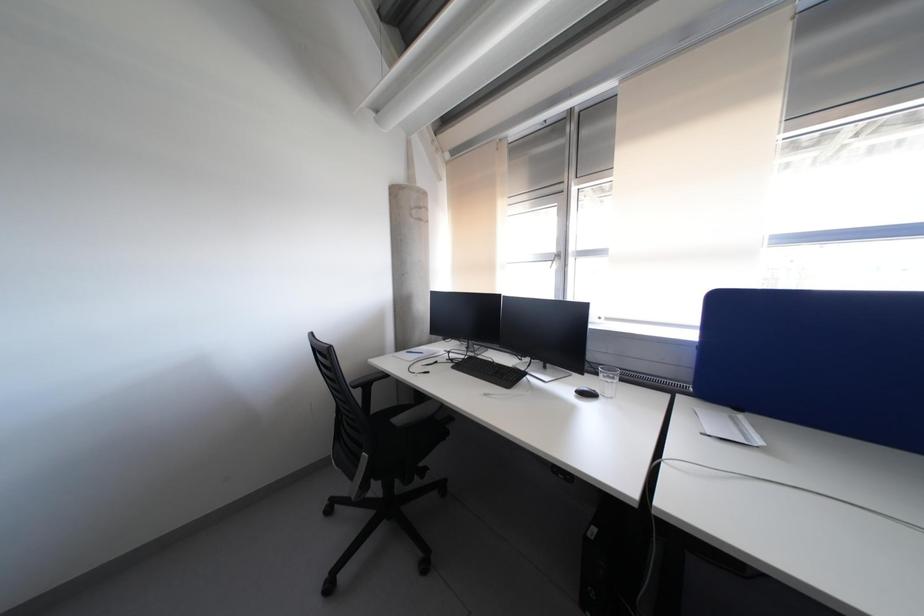
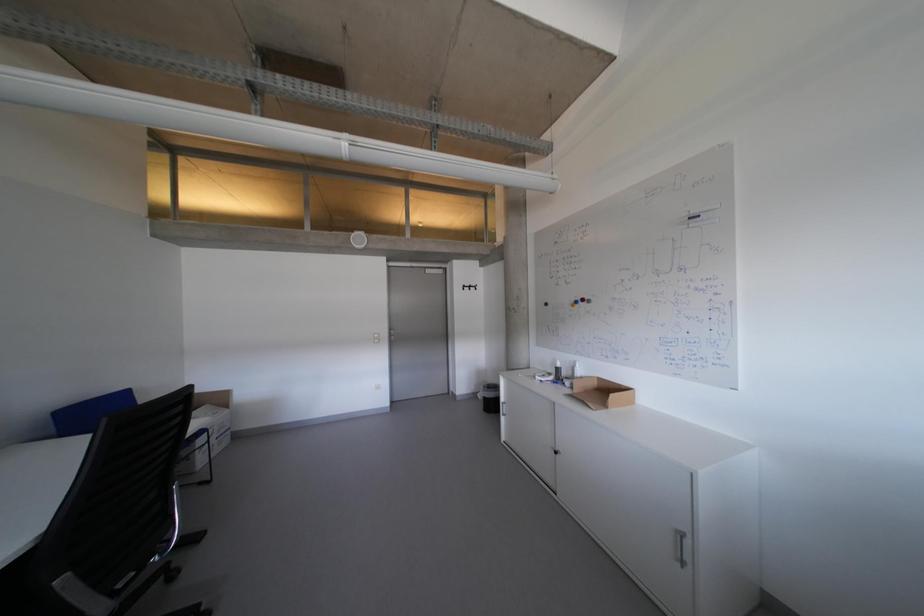
Question: Based on the continuous images, in which direction is the camera rotating? Reply with the corresponding letter.

Choices:
 (A) Left
 (B) Right
 (C) Up
 (D) Down

Answer: (A)